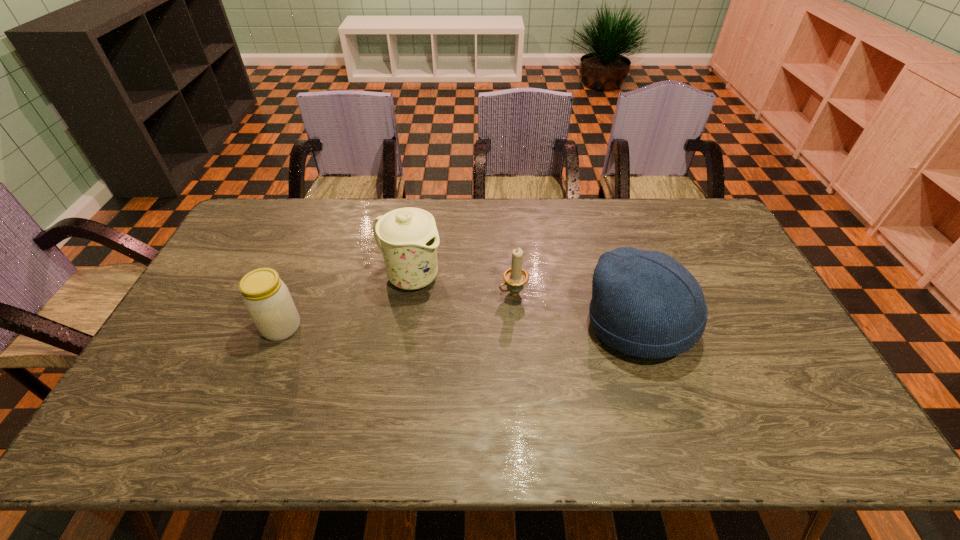
The image size is (960, 540). I want to click on free spot between the skullcap and the third object from left to right, so (576, 309).

Locate an element on the screen. free point between the candle_holder and the rightmost object is located at coordinates (576, 309).

Where is `free space between the second object from right to left and the chinaware`? free space between the second object from right to left and the chinaware is located at coordinates (462, 285).

Find the location of a particular element. The image size is (960, 540). vacant area that lies between the third object from right to left and the skullcap is located at coordinates (525, 301).

The width and height of the screenshot is (960, 540). I want to click on empty space between the leftmost object and the rightmost object, so click(461, 327).

Identify the location of blank region between the third object from left to right and the rightmost object. (576, 309).

Identify the location of the closest object to the chinaware. (515, 277).

Identify which object is the third nearest to the chinaware. Please provide its 2D coordinates. Your answer should be formatted as a tuple, i.e. [(x, y)], where the tuple contains the x and y coordinates of a point satisfying the conditions above.

[(646, 304)]

Identify the location of blank area in the image that satisfies the following two spatial constraints: 1. on the front side of the third object from right to left; 2. on the left side of the skullcap. This screenshot has width=960, height=540. (402, 326).

Image resolution: width=960 pixels, height=540 pixels. Identify the location of free space in the image that satisfies the following two spatial constraints: 1. on the back side of the jar; 2. on the right side of the skullcap. (282, 326).